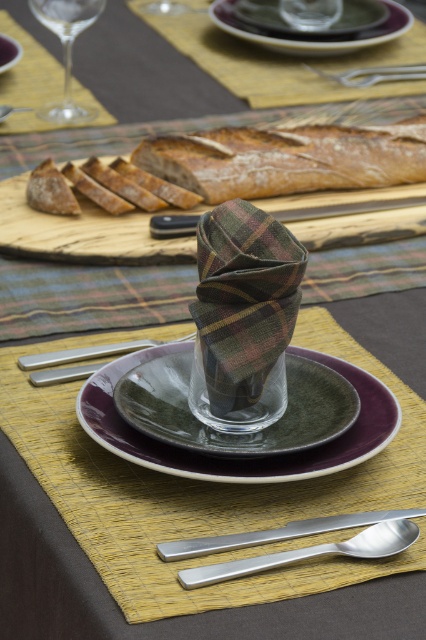
Who is positioned more to the left, brown crusty bread at center or silver metallic spoon at lower center?

From the viewer's perspective, silver metallic spoon at lower center appears more on the left side.

Between brown crusty bread at center and silver metallic spoon at lower center, which one appears on the right side from the viewer's perspective?

From the viewer's perspective, brown crusty bread at center appears more on the right side.

Which is behind, point (327, 147) or point (213, 580)?

Positioned behind is point (327, 147).

You are a GUI agent. You are given a task and a screenshot of the screen. Output one action in this format:
    pyautogui.click(x=<x>, y=<y>)
    Task: Click on the brown crusty bread at center
    The width and height of the screenshot is (426, 640).
    Given the screenshot: What is the action you would take?
    pyautogui.click(x=287, y=157)

Does silver metallic spoon at lower center have a greater width compared to purple glossy plate at center?

Yes.

Describe the element at coordinates (310, 554) in the screenshot. I see `silver metallic spoon at lower center` at that location.

The width and height of the screenshot is (426, 640). What are the coordinates of `silver metallic spoon at lower center` in the screenshot? It's located at (310, 554).

Find the location of `silver metallic spoon at lower center`. silver metallic spoon at lower center is located at coordinates (310, 554).

Locate an element on the screen. This screenshot has height=640, width=426. green matte plate at center is located at coordinates (236, 433).

Is point (169, 362) farther from viewer compared to point (8, 52)?

No, (169, 362) is in front of (8, 52).

Locate an element on the screen. green matte plate at center is located at coordinates (236, 433).